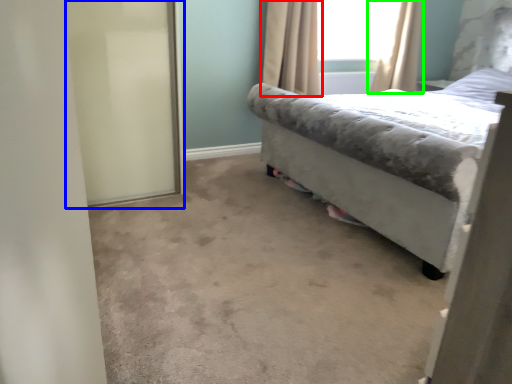
Question: Which object is positioned farthest from curtain (highlighted by a red box)? Select from screen door (highlighted by a blue box) and curtain (highlighted by a green box).

Choices:
 (A) screen door
 (B) curtain

Answer: (A)